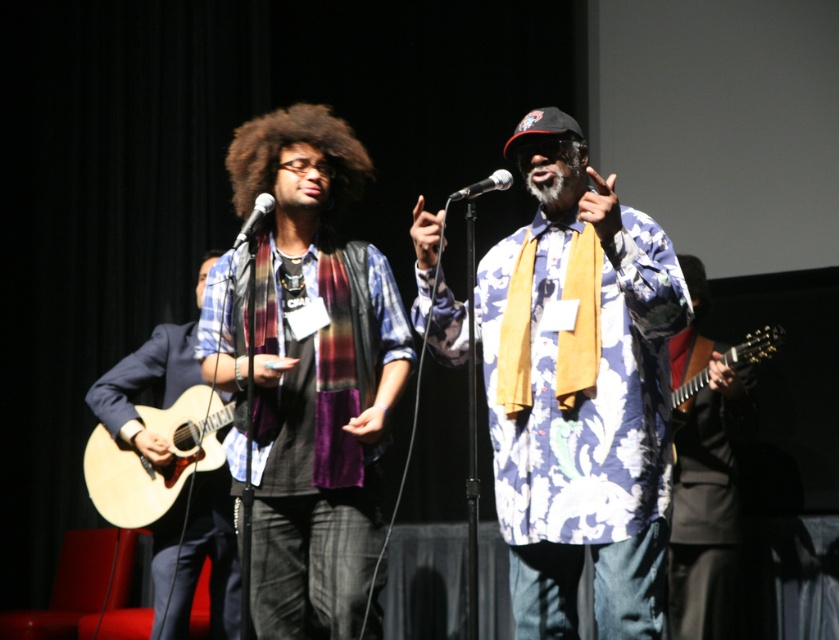
Question: Is floral-patterned shirt at center to the right of matte wood guitar at left from the viewer's perspective?

Choices:
 (A) yes
 (B) no

Answer: (A)

Question: Among these points, which one is farthest from the camera?

Choices:
 (A) (483, 180)
 (B) (671, 401)
 (C) (248, 234)

Answer: (B)

Question: Can you confirm if velvet scarf at center is positioned below dark curly hair at center?

Choices:
 (A) yes
 (B) no

Answer: (A)

Question: Estimate the real-world distances between objects in this image. Which object is farther from the dark curly hair at center?

Choices:
 (A) silver metallic microphone at center
 (B) velvet scarf at center
 (C) floral-patterned shirt at center

Answer: (C)

Question: Which is nearer to the matte wood guitar at left?

Choices:
 (A) matte black microphone at center
 (B) floral-patterned shirt at center
 (C) silver metallic microphone at center

Answer: (A)

Question: Is black glossy guitar at right smaller than light brown wood acoustic guitar at right?

Choices:
 (A) yes
 (B) no

Answer: (B)